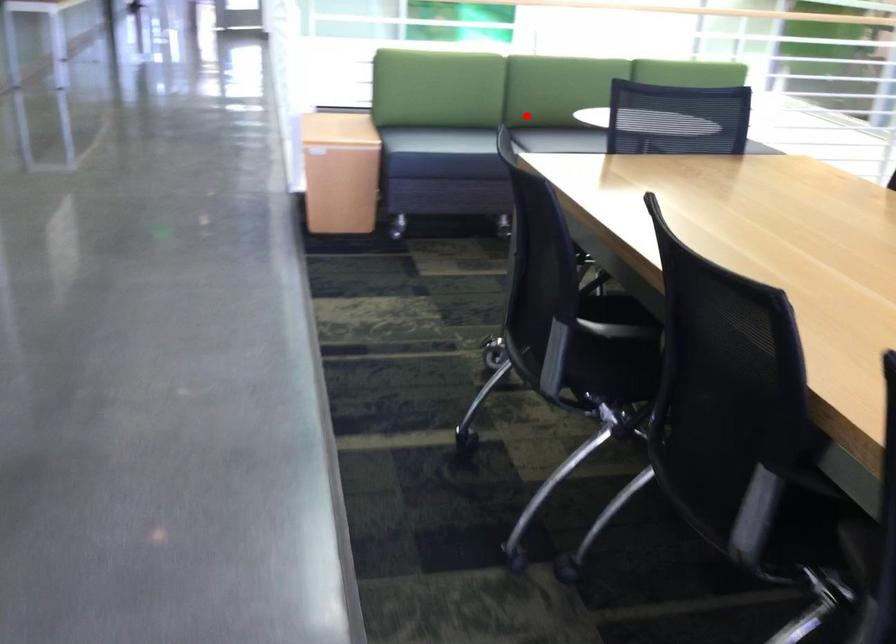
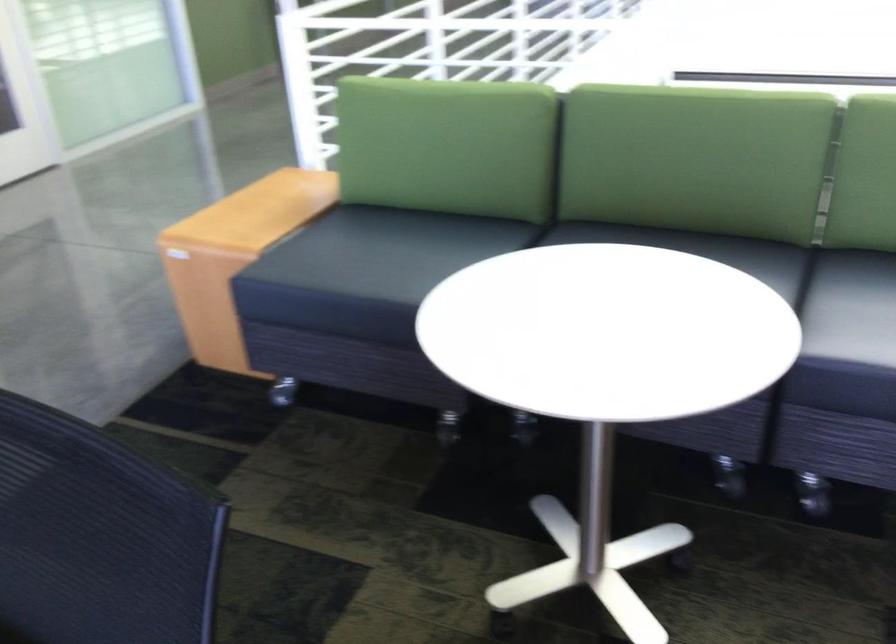
The point at the highlighted location is marked in the first image. Where is the corresponding point in the second image?

(702, 250)